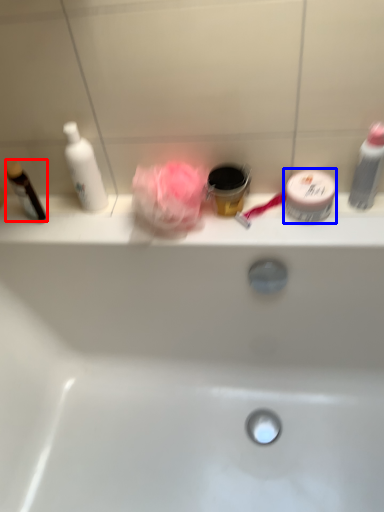
Question: Which object appears closest to the camera in this image, toiletry (highlighted by a red box) or toiletry (highlighted by a blue box)?

Choices:
 (A) toiletry
 (B) toiletry

Answer: (B)